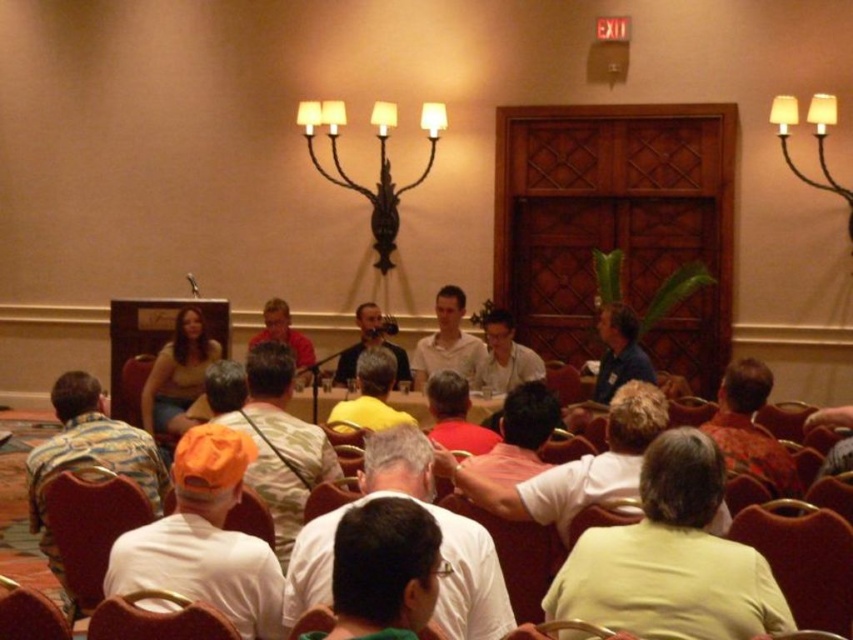
You are organizing a small workshop and need to seat a guest who requires a chair that is at least 50 cm wide. You have a velvet red chair at lower left and a matte yellow shirt at center available. Which chair can accommodate the guest?

The matte yellow shirt at center has a wider width than the velvet red chair at lower left, so the guest should use the matte yellow shirt at center.

You are sitting in the back row of the conference room and notice two people in the front row wearing a white shirt at center and a yellow matte shirt at center. From your perspective, which one is positioned more to the right?

The white shirt at center is positioned to the right of the yellow matte shirt at center, so from your perspective, the white shirt at center is more to the right.